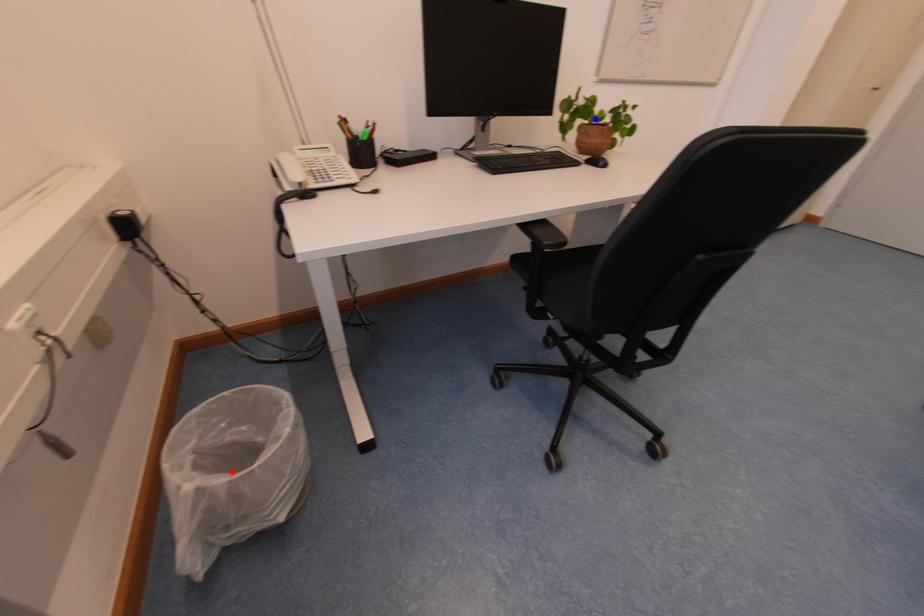
Question: In the image, two points are highlighted. Which point is nearer to the camera? Reply with the corresponding letter.

Choices:
 (A) blue point
 (B) red point

Answer: (B)